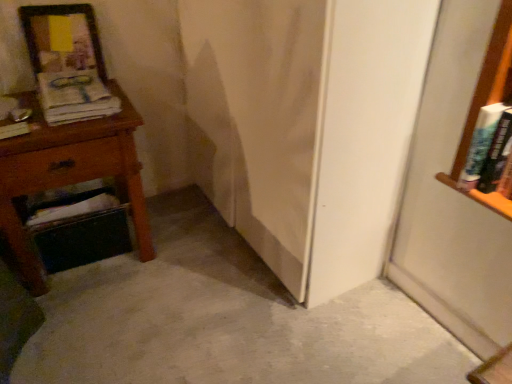
Find the location of `free space above matte paper magazine at left (from a real-world perspective)`. free space above matte paper magazine at left (from a real-world perspective) is located at coordinates (72, 92).